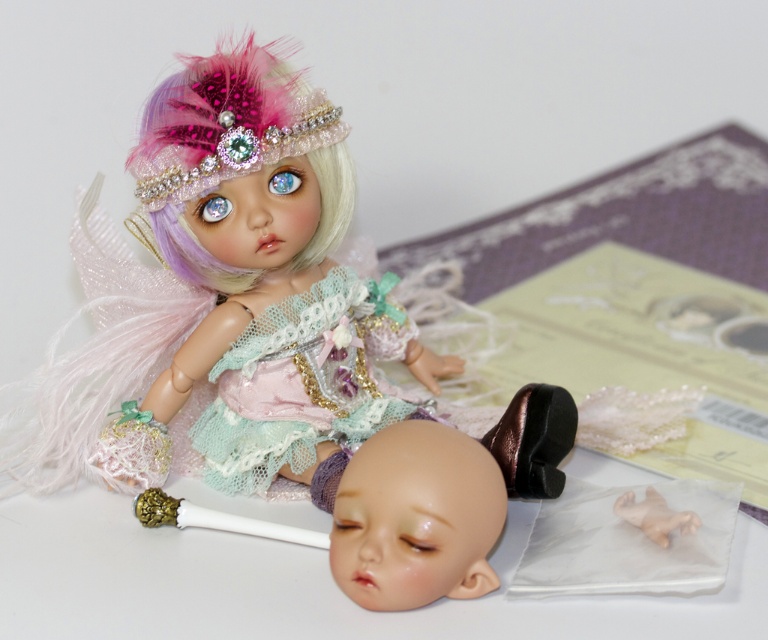
Is matte pink fabric doll at upper left to the left of translucent plastic hand at lower right from the viewer's perspective?

Indeed, matte pink fabric doll at upper left is positioned on the left side of translucent plastic hand at lower right.

From the picture: Who is more distant from viewer, (416,419) or (684,512)?

The point (416,419) is more distant.

The image size is (768, 640). What are the coordinates of `matte pink fabric doll at upper left` in the screenshot? It's located at (275, 348).

Is pastel pink feathered hair at upper left smaller than translucent plastic hand at lower right?

No, pastel pink feathered hair at upper left is not smaller than translucent plastic hand at lower right.

Is point (330, 236) more distant than point (621, 499)?

Yes, point (330, 236) is farther from viewer.

Locate an element on the screen. pastel pink feathered hair at upper left is located at coordinates (328, 204).

Who is positioned more to the right, matte pink fabric doll at upper left or pastel pink feathered hair at upper left?

From the viewer's perspective, matte pink fabric doll at upper left appears more on the right side.

Is point (330, 161) behind point (230, 291)?

No, (330, 161) is in front of (230, 291).

I want to click on matte pink fabric doll at upper left, so point(275,348).